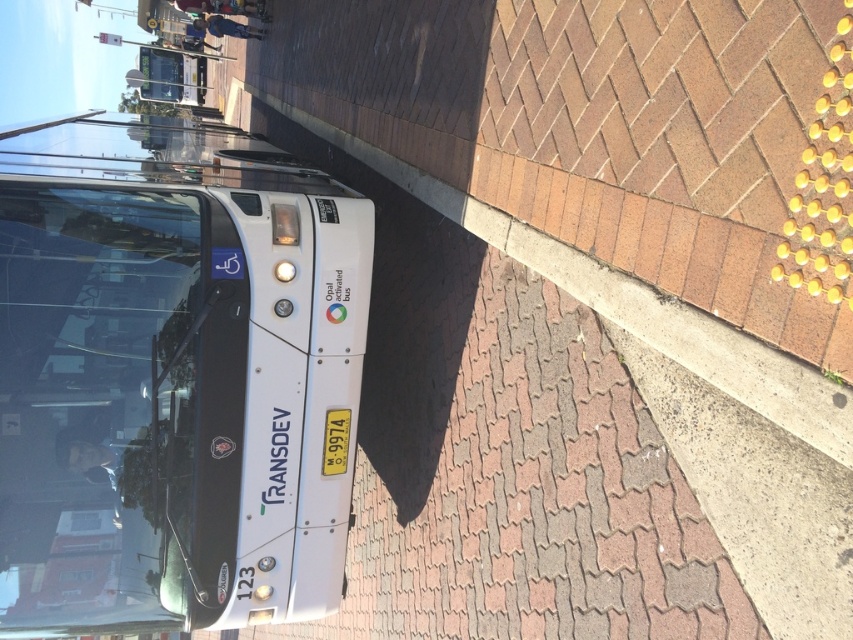
You are a visually impaired person using a cane. You are standing on the concrete at lower right and want to board the white matte bus at left. Can you feel the tactile paving strip that guides towards the bus?

The white matte bus at left is located above concrete at lower right, so the tactile paving strip to the right of the bus would not be directly accessible from your current position on the concrete at lower right. You may need to move towards the bus area to locate the tactile paving strip.

You are a visually impaired person waiting at the bus stop. You feel the tactile paving strip to your right. Based on the bus stop layout, where is the white matte bus at left relative to your position?

The white matte bus at left is positioned to your left side since the tactile paving strip is on your right, and the bus is on the brick paved area opposite to the curb.

You are a delivery person with a cart that is 4 meters long. You need to move your cart from the white matte bus at left to the concrete at lower right. Is there enough space for your cart to fit between them?

The distance between the white matte bus at left and the concrete at lower right is 3.75 meters. Since the cart is 4 meters long, it is slightly too long to fit in the space provided. You may need to find an alternative route or reposition your cart to accommodate the limited space.